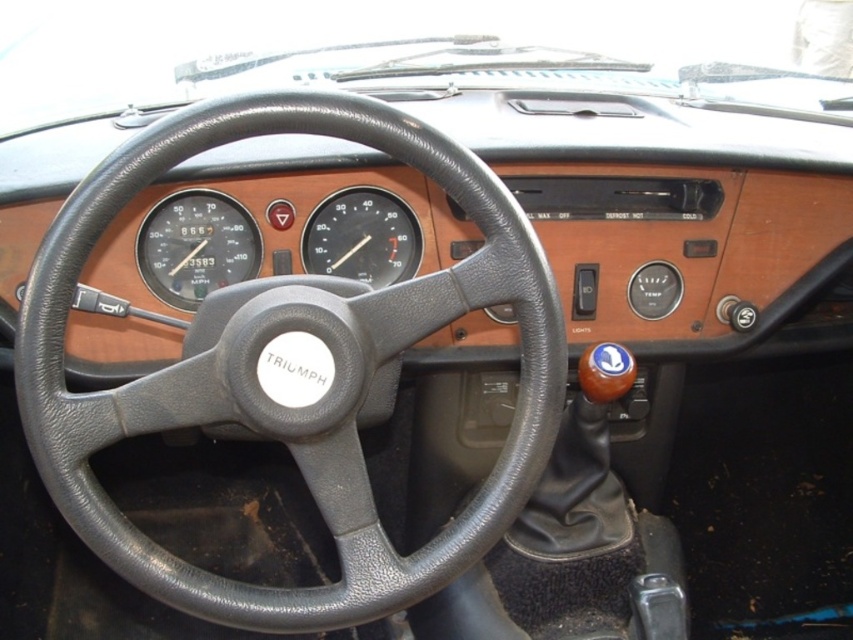
What is the position of the matte black speedometer at center on the dashboard?

The matte black speedometer at center is located at point coordinates of (196,246).

You are standing next to the vintage Triumph vehicle and want to see the point at coordinates point [160,204] on the dashboard. If you are 4.02 feet away from the camera, can you see the point clearly?

The point [160,204] is 4.02 feet away from the camera, so you can see it clearly from that distance.

You are driving a vintage Triumph car and notice two speedometers on the dashboard. The first is labeled as the matte black speedometer at center, and the second is the black plastic speedometer at center. Which one is positioned to the left?

The matte black speedometer at center is to the left of the black plastic speedometer at center.